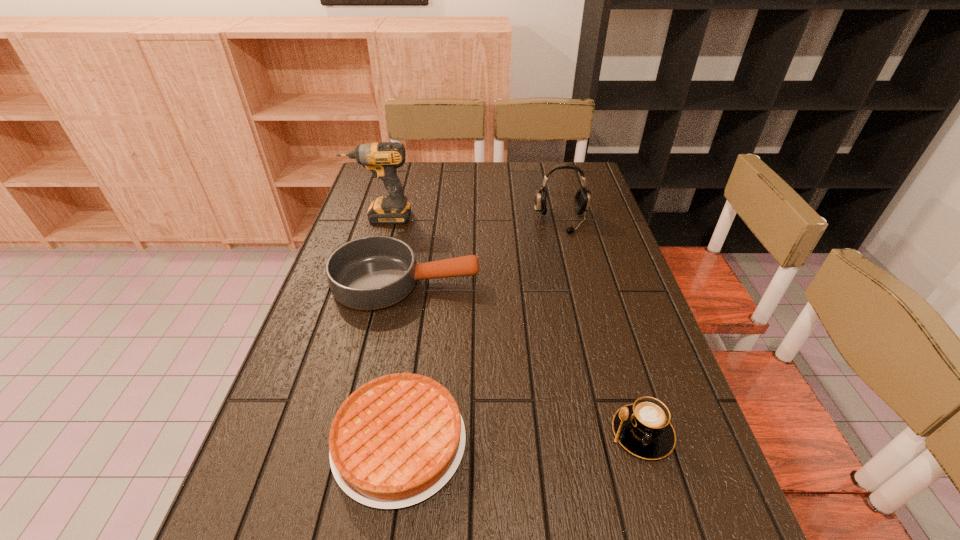
Locate an element on the screen. The width and height of the screenshot is (960, 540). pan that is at the left edge is located at coordinates (369, 273).

I want to click on pie at the left edge, so click(x=398, y=439).

Find the location of a particular element. The width and height of the screenshot is (960, 540). headset positioned at the right edge is located at coordinates (582, 198).

Where is `cappuccino present at the right edge`? The width and height of the screenshot is (960, 540). cappuccino present at the right edge is located at coordinates (644, 429).

I want to click on free space at the far edge, so click(x=458, y=190).

In the image, there is a desktop. Identify the location of vacant space at the left edge. The height and width of the screenshot is (540, 960). (324, 328).

Image resolution: width=960 pixels, height=540 pixels. Find the location of `blank space at the right edge of the desktop`. blank space at the right edge of the desktop is located at coordinates (618, 233).

The width and height of the screenshot is (960, 540). I want to click on free space at the far left corner of the desktop, so click(x=400, y=179).

Find the location of a particular element. empty space that is in between the shortest object and the second tallest object is located at coordinates (480, 332).

Locate an element on the screen. The image size is (960, 540). free space between the fourth shortest object and the cappuccino is located at coordinates (602, 327).